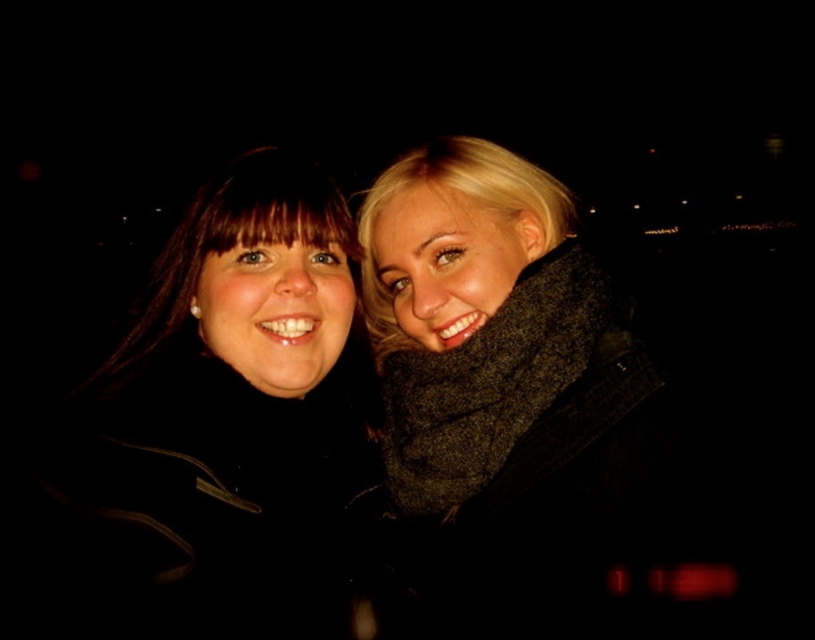
Which is above, black matte jacket at left or matte black coat at left?

Positioned higher is matte black coat at left.

This screenshot has height=640, width=815. Identify the location of black matte jacket at left. (234, 413).

Locate an element on the screen. The height and width of the screenshot is (640, 815). black matte jacket at left is located at coordinates (234, 413).

Is dark gray wool scarf at right to the left of matte black coat at left from the viewer's perspective?

No, dark gray wool scarf at right is not to the left of matte black coat at left.

Is dark gray wool scarf at right bigger than matte black coat at left?

Incorrect, dark gray wool scarf at right is not larger than matte black coat at left.

Locate an element on the screen. The width and height of the screenshot is (815, 640). dark gray wool scarf at right is located at coordinates (509, 387).

Can you confirm if dark gray wool scarf at right is positioned to the left of black matte jacket at left?

No, dark gray wool scarf at right is not to the left of black matte jacket at left.

Is point (425, 372) farther from viewer compared to point (263, 516)?

Yes, it is behind point (263, 516).

Image resolution: width=815 pixels, height=640 pixels. Find the location of `dark gray wool scarf at right`. dark gray wool scarf at right is located at coordinates (509, 387).